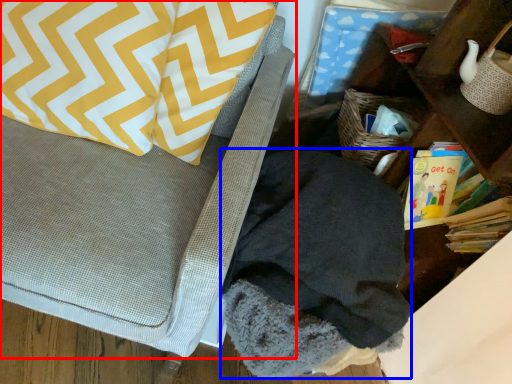
Question: Which object is closer to the camera taking this photo, furniture (highlighted by a red box) or clothing (highlighted by a blue box)?

Choices:
 (A) furniture
 (B) clothing

Answer: (A)